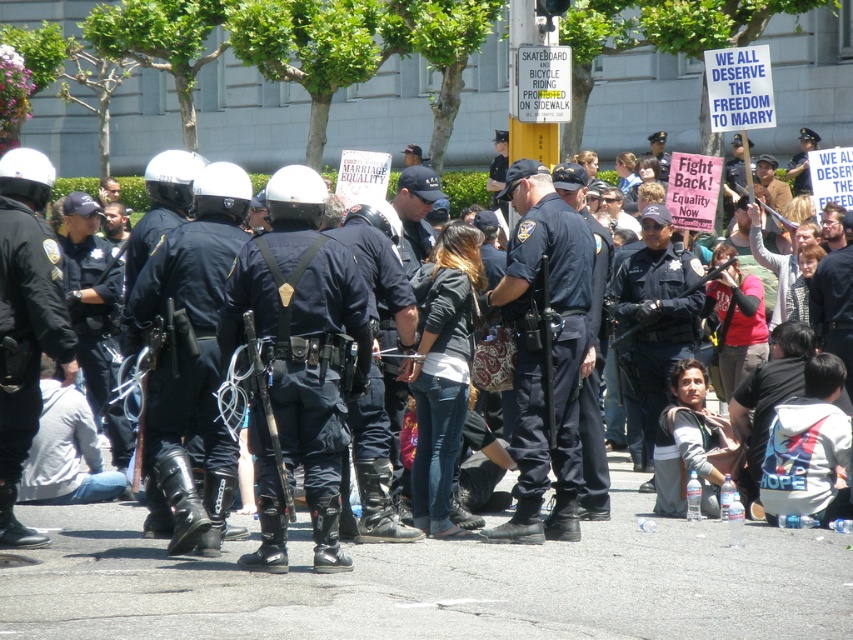
You are a drone operator trying to locate the black matte uniform at center in the image. According to the coordinates provided, where would you direct the drone to focus?

The black matte uniform at center is located at coordinates point (193, 356).

You are a photographer standing at the camera position. You want to capture a photo of the protesters located at point (x=228, y=484). Your camera has a maximum focus range of 50 feet. Will you be able to focus on the protesters at that point?

The distance between the camera and the protesters at point (x=228, y=484) is 53.22 feet, which exceeds the camera maximum focus range of 50 feet. Therefore, the camera will not be able to focus on the protesters at that point.